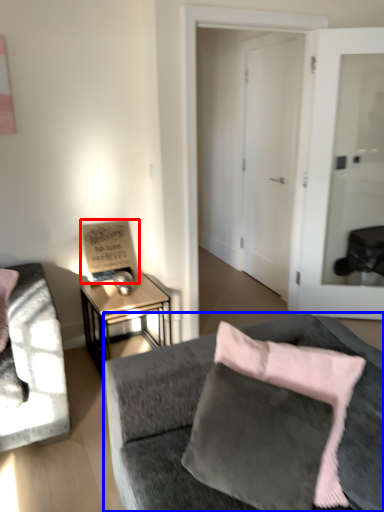
Question: Which object appears closest to the camera in this image, bulletin board (highlighted by a red box) or studio couch (highlighted by a blue box)?

Choices:
 (A) bulletin board
 (B) studio couch

Answer: (B)